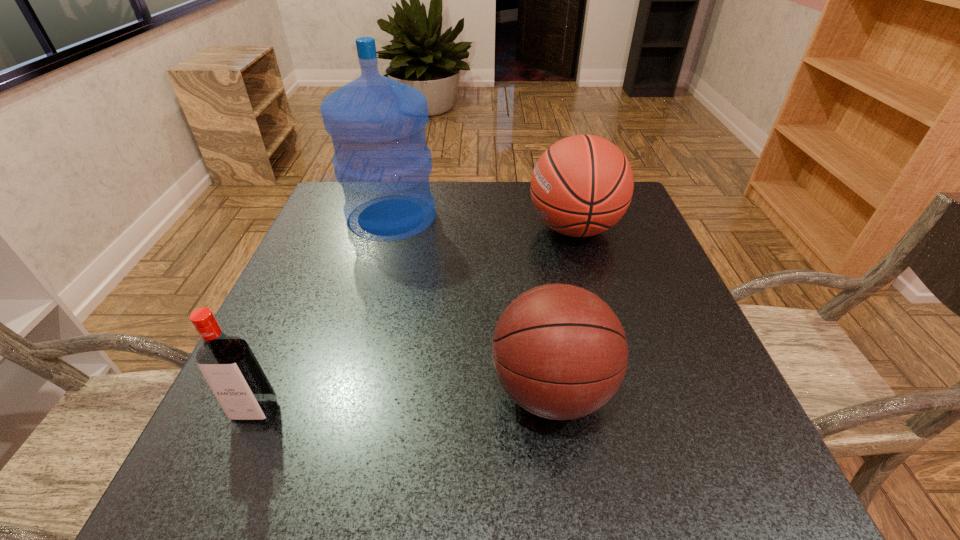
Where is `the tallest object`? the tallest object is located at coordinates (377, 125).

Locate an element on the screen. the farther basketball is located at coordinates (582, 185).

Find the location of `vodka`. vodka is located at coordinates (228, 364).

Where is `the nearer basketball`? the nearer basketball is located at coordinates (559, 351).

This screenshot has width=960, height=540. In order to click on vacant space situated on the right of the tallest object in this screenshot , I will do point(511,217).

This screenshot has height=540, width=960. In order to click on vacant space situated on the logo side of the farther basketball in this screenshot , I will do `click(384, 228)`.

Identify the location of vacant area situated 0.310m on the logo side of the farther basketball. Image resolution: width=960 pixels, height=540 pixels. (400, 228).

Find the location of a particular element. vacant space situated on the logo side of the farther basketball is located at coordinates (368, 228).

Where is `vacant region located on the front and back of the vodka`? The width and height of the screenshot is (960, 540). vacant region located on the front and back of the vodka is located at coordinates (230, 471).

In order to click on free region located on the left of the nearer basketball in this screenshot , I will do `click(363, 390)`.